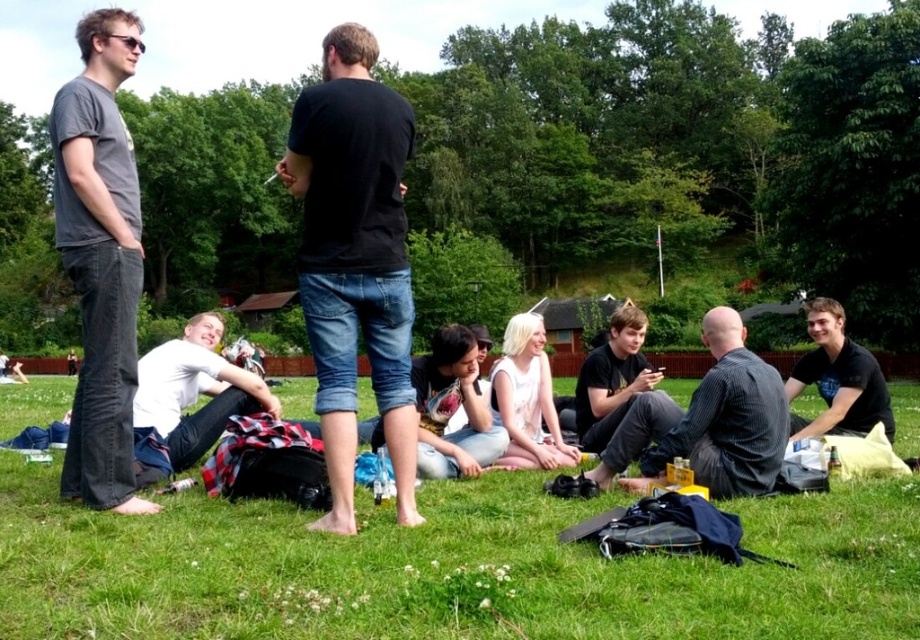
You are organizing a group photo and need to arrange two people in the front row. The participants are wearing a black cotton shirt at center and a dark gray striped shirt at center. Since you want to maximize the visibility of both, which shirt should be placed on the sides to accommodate their sizes?

The black cotton shirt at center is wider than the dark gray striped shirt at center, so placing the black cotton shirt at center on the sides would allow more space for both participants.

You are organizing a group photo and need to arrange the dark gray striped shirt at center and the black cotton shirt at lower right in a row from smallest to largest. Based on their sizes, which order should they be placed in?

The dark gray striped shirt at center is smaller than the black cotton shirt at lower right, so they should be arranged with the dark gray striped shirt at center first, followed by the black cotton shirt at lower right.

You are organizing a clothing drive and need to determine which of the two shirts, the dark gray striped shirt at center or the black cotton shirt at lower right, can fit into a narrow donation box that requires the shirt to be thinner. Which shirt should you choose?

The dark gray striped shirt at center is thinner than the black cotton shirt at lower right, so you should choose the dark gray striped shirt at center for the narrow donation box.